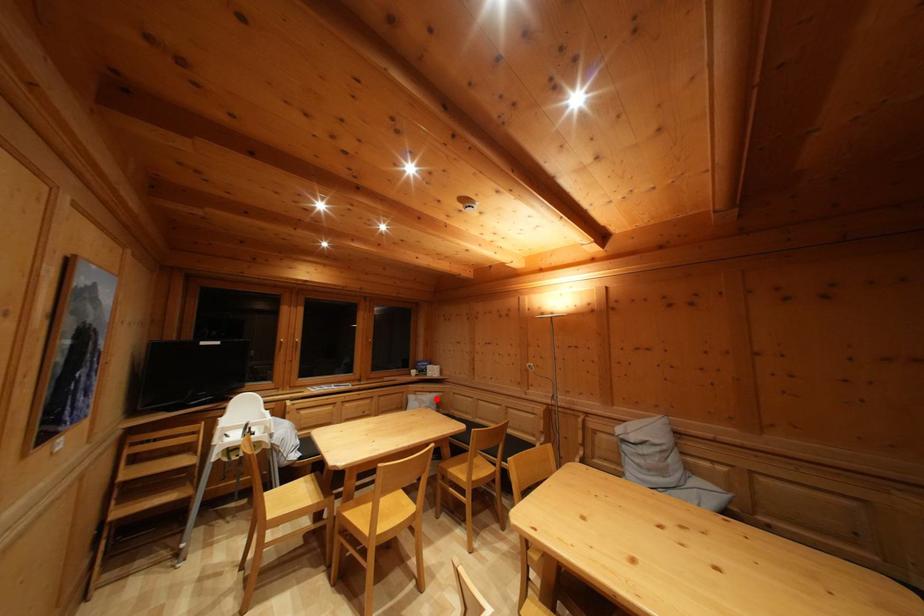
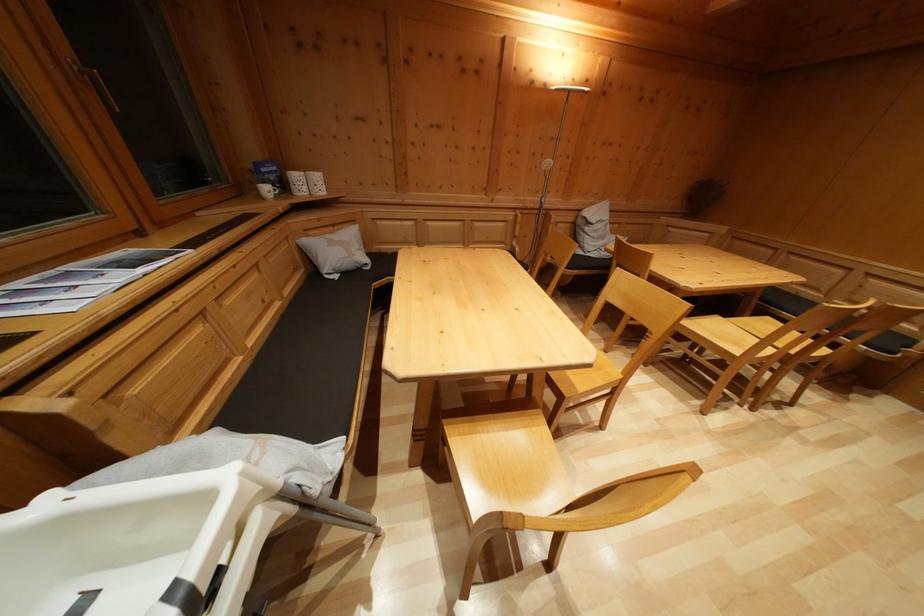
Question: I am providing you with two images of the same scene from different viewpoints. Image1 has a red point marked. In image2, the corresponding 3D location appears at what relative position? Reply with the corresponding letter.

Choices:
 (A) Closer
 (B) Farther

Answer: (A)